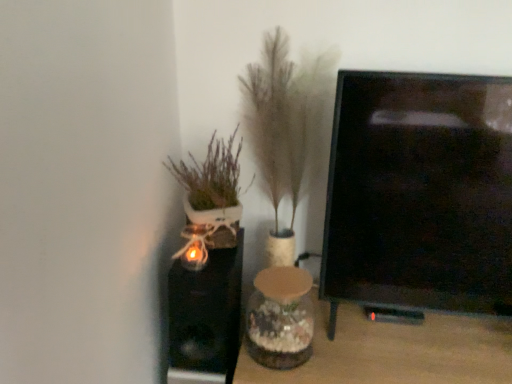
Question: Which direction should I rotate to look at fuzzy beige plant at center, which is the 1th houseplant from right to left, — up or down?

Choices:
 (A) down
 (B) up

Answer: (B)

Question: From a real-world perspective, is fuzzy beige plant at center, the 2th houseplant when ordered from left to right, on translucent glass vase at center?

Choices:
 (A) no
 (B) yes

Answer: (B)

Question: Is fuzzy beige plant at center, the 2th houseplant when ordered from left to right, facing towards translucent glass vase at center?

Choices:
 (A) no
 (B) yes

Answer: (B)

Question: Is fuzzy beige plant at center, the 2th houseplant when ordered from left to right, shorter than translucent glass vase at center?

Choices:
 (A) yes
 (B) no

Answer: (B)

Question: Is translucent glass vase at center a part of fuzzy beige plant at center, the 2th houseplant when ordered from left to right?

Choices:
 (A) yes
 (B) no

Answer: (B)

Question: Does fuzzy beige plant at center, the 2th houseplant when ordered from left to right, touch translucent glass vase at center?

Choices:
 (A) no
 (B) yes

Answer: (A)

Question: Considering the relative sizes of fuzzy beige plant at center, which is the 1th houseplant from right to left, and translucent glass vase at center in the image provided, is fuzzy beige plant at center, which is the 1th houseplant from right to left, thinner than translucent glass vase at center?

Choices:
 (A) no
 (B) yes

Answer: (B)

Question: Is clear glass vase at center wider than translucent glass vase at center?

Choices:
 (A) yes
 (B) no

Answer: (A)

Question: From the image's perspective, does clear glass vase at center appear lower than translucent glass vase at center?

Choices:
 (A) no
 (B) yes

Answer: (B)

Question: Does clear glass vase at center appear on the left side of translucent glass vase at center?

Choices:
 (A) yes
 (B) no

Answer: (B)

Question: Is clear glass vase at center smaller than translucent glass vase at center?

Choices:
 (A) no
 (B) yes

Answer: (A)

Question: Is clear glass vase at center turned away from translucent glass vase at center?

Choices:
 (A) no
 (B) yes

Answer: (A)

Question: From a real-world perspective, is clear glass vase at center physically below translucent glass vase at center?

Choices:
 (A) no
 (B) yes

Answer: (B)

Question: Can you confirm if white ceramic pot at left, arranged as the second houseplant when viewed from the right, is shorter than clear glass vase at center?

Choices:
 (A) no
 (B) yes

Answer: (B)